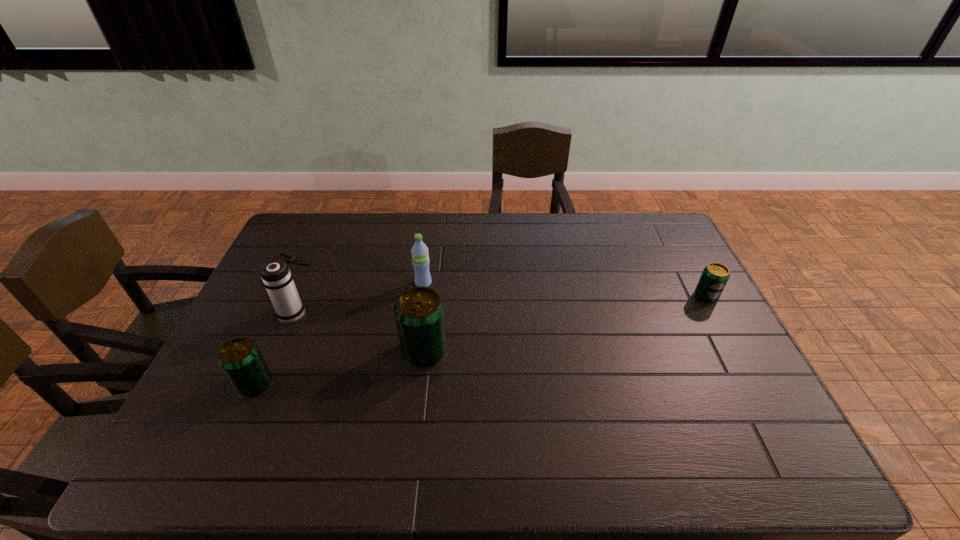
Locate an element on the screen. The width and height of the screenshot is (960, 540). free region that satisfies the following two spatial constraints: 1. on the back side of the fifth tallest object; 2. on the right side of the leftmost beer can is located at coordinates (294, 296).

Find the location of `free spot that satisfies the following two spatial constraints: 1. on the side with the handle of the rightmost object; 2. on the left side of the thermos bottle`. free spot that satisfies the following two spatial constraints: 1. on the side with the handle of the rightmost object; 2. on the left side of the thermos bottle is located at coordinates (300, 296).

Locate an element on the screen. The image size is (960, 540). vacant space that satisfies the following two spatial constraints: 1. on the side with the handle of the thermos bottle; 2. on the left side of the fifth tallest object is located at coordinates (300, 296).

Identify the location of vacant space that satisfies the following two spatial constraints: 1. on the front side of the tallest beer can; 2. on the right side of the water bottle. The height and width of the screenshot is (540, 960). (414, 350).

Find the location of a particular element. The image size is (960, 540). vacant space that satisfies the following two spatial constraints: 1. on the front side of the water bottle; 2. on the right side of the pliers is located at coordinates (283, 284).

Find the location of a particular element. This screenshot has height=540, width=960. free location that satisfies the following two spatial constraints: 1. on the front side of the pliers; 2. on the right side of the tallest beer can is located at coordinates (251, 350).